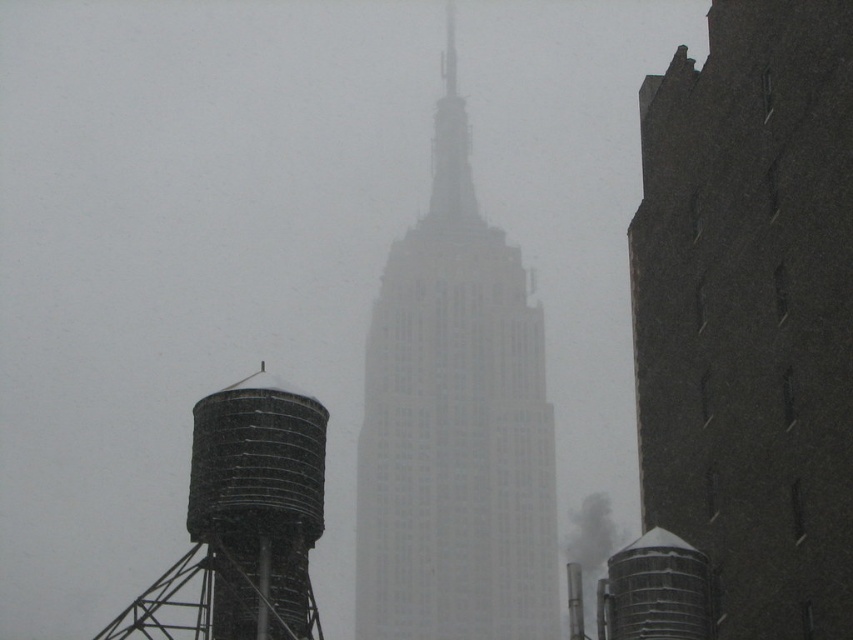
Can you confirm if white glass tower at center is taller than rusty metal water tower at lower left?

Indeed, white glass tower at center has a greater height compared to rusty metal water tower at lower left.

Can you confirm if white glass tower at center is positioned to the right of rusty metal water tower at lower left?

Indeed, white glass tower at center is positioned on the right side of rusty metal water tower at lower left.

Is point (412, 476) less distant than point (189, 525)?

No, (412, 476) is further to viewer.

At what (x,y) coordinates should I click in order to perform the action: click on white glass tower at center. Please return your answer as a coordinate pair (x, y). Looking at the image, I should click on (456, 424).

What do you see at coordinates (258, 502) in the screenshot? I see `rusty metal water tower at lower left` at bounding box center [258, 502].

This screenshot has height=640, width=853. What do you see at coordinates (258, 502) in the screenshot?
I see `rusty metal water tower at lower left` at bounding box center [258, 502].

Locate an element on the screen. rusty metal water tower at lower left is located at coordinates (258, 502).

What do you see at coordinates (456, 424) in the screenshot? The image size is (853, 640). I see `white glass tower at center` at bounding box center [456, 424].

Which is below, white glass tower at center or smokematerial/texture at center?

smokematerial/texture at center is lower down.

Who is more distant from viewer, (492, 307) or (616, 541)?

Point (616, 541)

Where is `white glass tower at center`? The height and width of the screenshot is (640, 853). white glass tower at center is located at coordinates (456, 424).